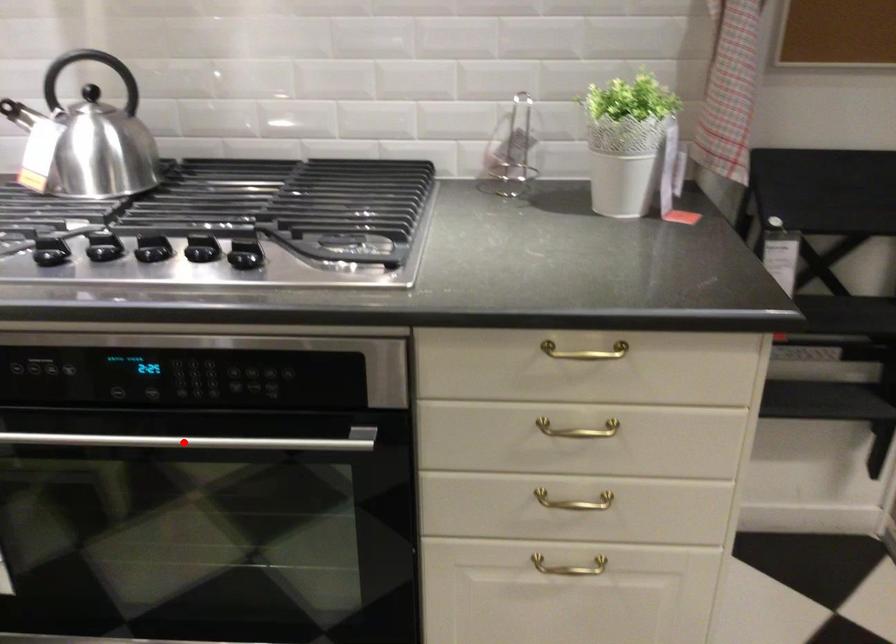
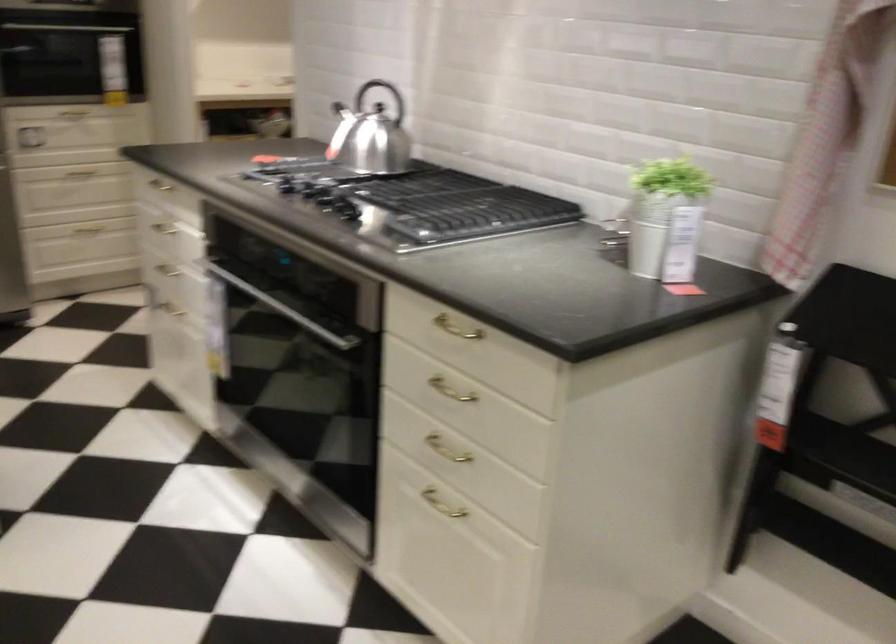
Locate, in the second image, the point that corresponds to the highlighted location in the first image.

(282, 308)